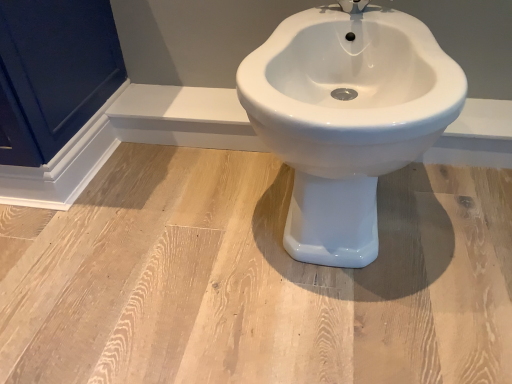
In order to face white glossy bidet at center, should I rotate leftwards or rightwards?

Rotate your view right by about 10.603°.

What do you see at coordinates (346, 118) in the screenshot? I see `white glossy bidet at center` at bounding box center [346, 118].

Where is `white glossy bidet at center`? white glossy bidet at center is located at coordinates (346, 118).

At what (x,y) coordinates should I click in order to perform the action: click on white glossy bidet at center. Please return your answer as a coordinate pair (x, y). Looking at the image, I should click on (346, 118).